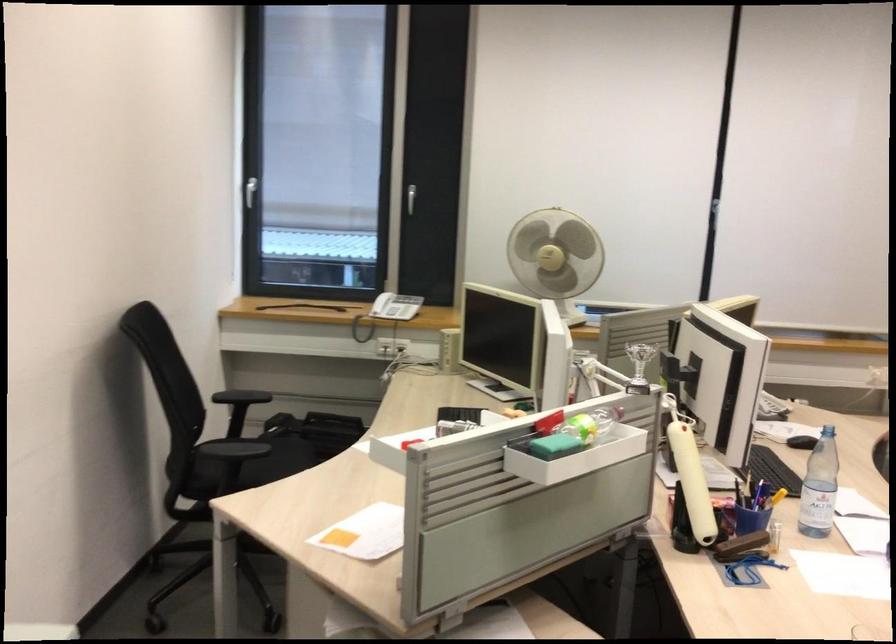
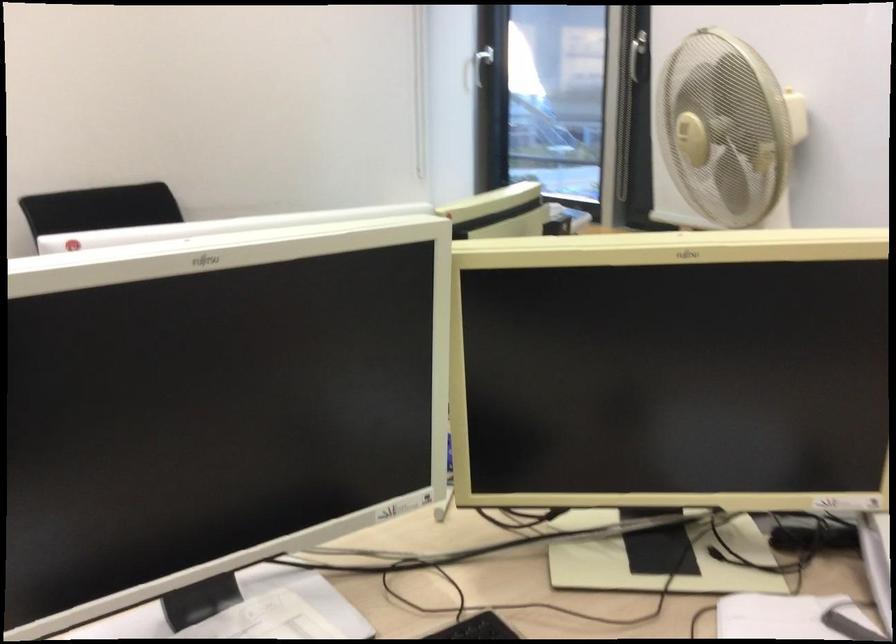
Question: I am providing you with two images of the same scene from different viewpoints. Which of the following objects are not visible in image2?

Choices:
 (A) white window handle
 (B) plaid water bottle
 (C) scanner lid
 (D) small silver trophy

Answer: (D)